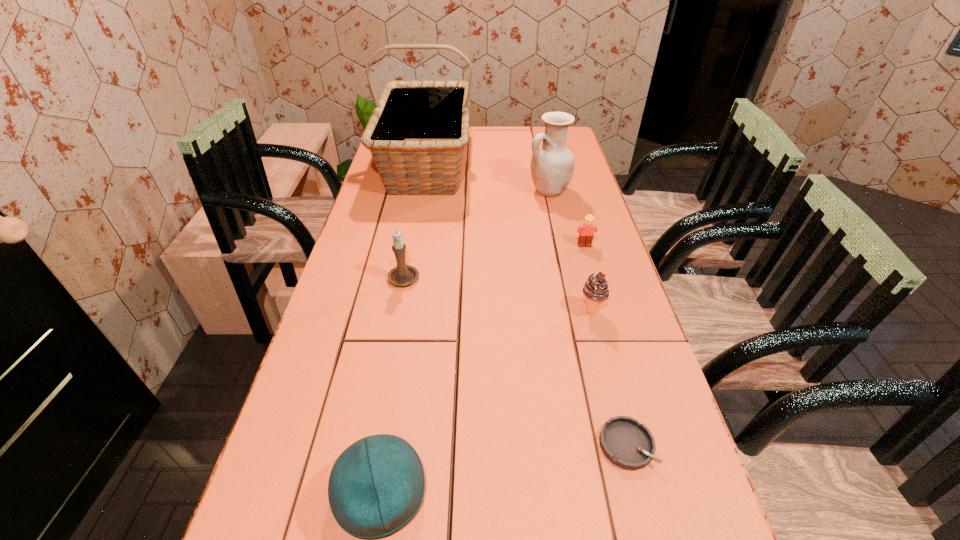
Where is `free space between the shortest object and the fifth shortest object`? free space between the shortest object and the fifth shortest object is located at coordinates (516, 360).

Image resolution: width=960 pixels, height=540 pixels. Identify the location of free space between the shortest object and the Lego. (606, 345).

You are a GUI agent. You are given a task and a screenshot of the screen. Output one action in this format:
    pyautogui.click(x=<x>, y=<y>)
    Task: Click on the vacant area between the pottery and the tallest object
    The height and width of the screenshot is (540, 960).
    Given the screenshot: What is the action you would take?
    pyautogui.click(x=488, y=178)

At what (x,y) coordinates should I click in order to perform the action: click on free space between the shortest object and the third nearest object. Please return your answer as a coordinate pair (x, y). Image resolution: width=960 pixels, height=540 pixels. Looking at the image, I should click on (609, 377).

I want to click on vacant region between the third farthest object and the ashtray, so click(606, 345).

At what (x,y) coordinates should I click in order to perform the action: click on empty space between the pottery and the sixth tallest object. Please return your answer as a coordinate pair (x, y). The height and width of the screenshot is (540, 960). Looking at the image, I should click on (566, 218).

Point out which object is positioned as the fourth nearest to the icecream. Please provide its 2D coordinates. Your answer should be formatted as a tuple, i.e. [(x, y)], where the tuple contains the x and y coordinates of a point satisfying the conditions above.

[(552, 164)]

Locate an element on the screen. the third closest object relative to the shortest object is located at coordinates (403, 275).

Where is `free region that satisfies the following two spatial constraints: 1. on the side of the pottery with the handle; 2. on the right side of the third tallest object`? The height and width of the screenshot is (540, 960). free region that satisfies the following two spatial constraints: 1. on the side of the pottery with the handle; 2. on the right side of the third tallest object is located at coordinates (420, 191).

Locate an element on the screen. free space that satisfies the following two spatial constraints: 1. on the side of the fourth farthest object with the handle; 2. on the left side of the second tallest object is located at coordinates (420, 191).